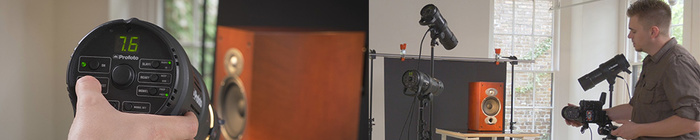
Identify the location of blinds. coord(525,13).